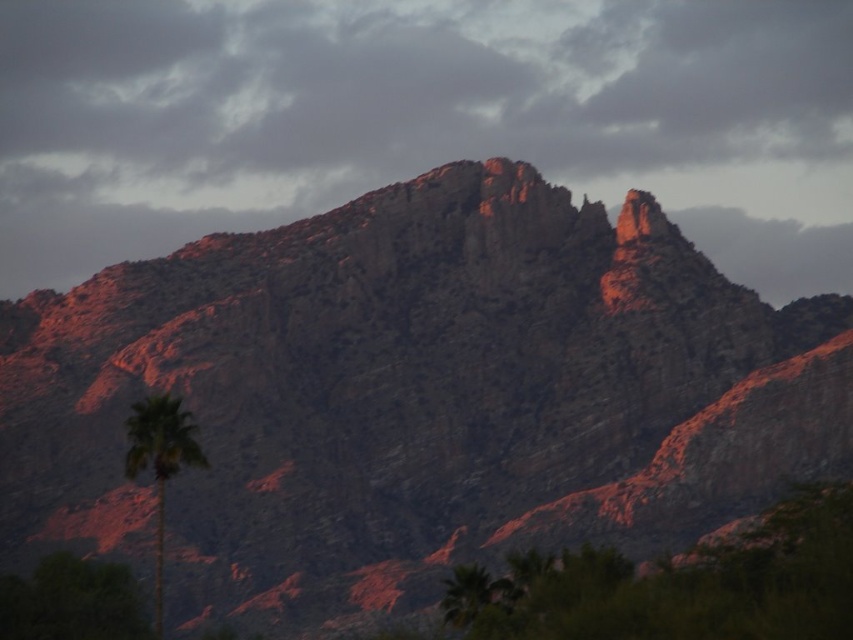
You are an explorer in the desert and see the smokey gray cloud at upper center and the green leafy palm at lower left. Which object is higher in the sky?

The smokey gray cloud at upper center is higher in the sky than the green leafy palm at lower left because it is positioned over it.

Based on the scene described, which object is positioned to the right when comparing the smokey gray cloud at upper center and the green leafy palm at lower left?

The smokey gray cloud at upper center is positioned to the right of the green leafy palm at lower left.

You are a hiker trying to determine the best path to the summit. You notice the smokey gray cloud at upper center and the green leafy palm at lower left. Which object is closer to you from your current position?

The green leafy palm at lower left is behind the smokey gray cloud at upper center, so the smokey gray cloud at upper center is closer to you.